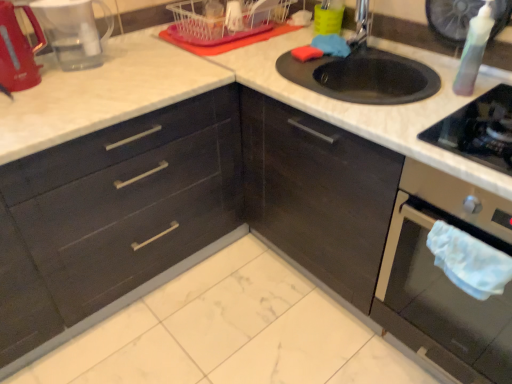
The height and width of the screenshot is (384, 512). Find the location of `free space to the back side of red plastic coffee maker at upper left`. free space to the back side of red plastic coffee maker at upper left is located at coordinates (106, 50).